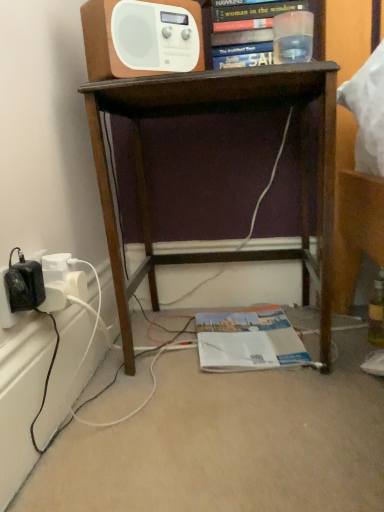
Question: Does white glossy magazine at lower center have a larger size compared to white plastic radio at upper center?

Choices:
 (A) no
 (B) yes

Answer: (B)

Question: Could you tell me if white glossy magazine at lower center is turned towards white plastic radio at upper center?

Choices:
 (A) no
 (B) yes

Answer: (A)

Question: Considering the relative sizes of white glossy magazine at lower center and white plastic radio at upper center in the image provided, is white glossy magazine at lower center taller than white plastic radio at upper center?

Choices:
 (A) no
 (B) yes

Answer: (A)

Question: Does white glossy magazine at lower center come behind white plastic radio at upper center?

Choices:
 (A) no
 (B) yes

Answer: (B)

Question: Is white glossy magazine at lower center thinner than white plastic radio at upper center?

Choices:
 (A) no
 (B) yes

Answer: (A)

Question: From a real-world perspective, is white glossy magazine at lower center positioned over white plastic radio at upper center based on gravity?

Choices:
 (A) yes
 (B) no

Answer: (B)

Question: Would you say white plastic radio at upper center is outside brown wood desk at center?

Choices:
 (A) yes
 (B) no

Answer: (A)

Question: Considering the relative sizes of white plastic radio at upper center and brown wood desk at center in the image provided, is white plastic radio at upper center wider than brown wood desk at center?

Choices:
 (A) no
 (B) yes

Answer: (A)

Question: Is white plastic radio at upper center behind brown wood desk at center?

Choices:
 (A) yes
 (B) no

Answer: (A)

Question: Does white plastic radio at upper center appear on the right side of brown wood desk at center?

Choices:
 (A) no
 (B) yes

Answer: (A)

Question: Considering the relative sizes of white plastic radio at upper center and brown wood desk at center in the image provided, is white plastic radio at upper center taller than brown wood desk at center?

Choices:
 (A) yes
 (B) no

Answer: (B)

Question: Is white plastic radio at upper center to the left of brown wood desk at center from the viewer's perspective?

Choices:
 (A) no
 (B) yes

Answer: (B)

Question: Is brown wood desk at center oriented towards white glossy magazine at lower center?

Choices:
 (A) yes
 (B) no

Answer: (B)